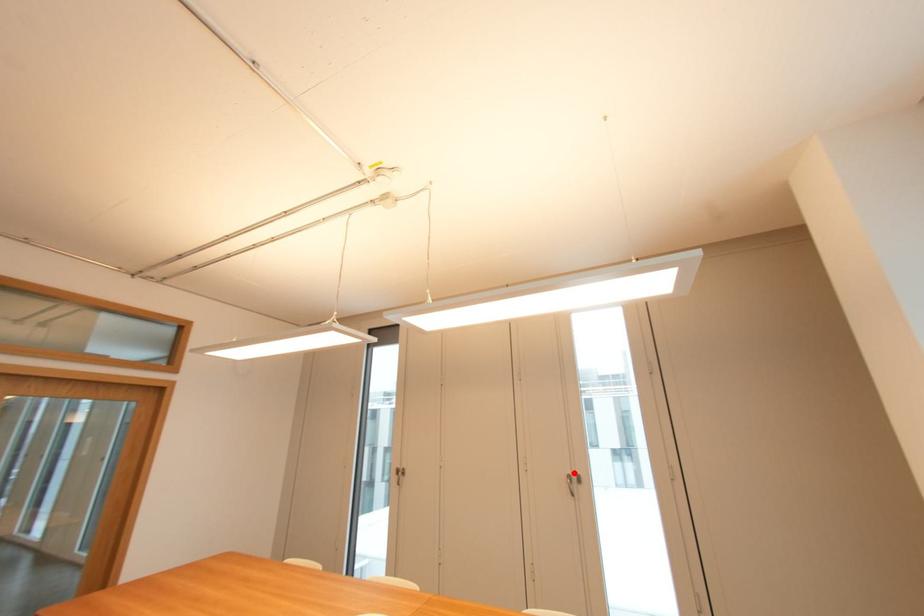
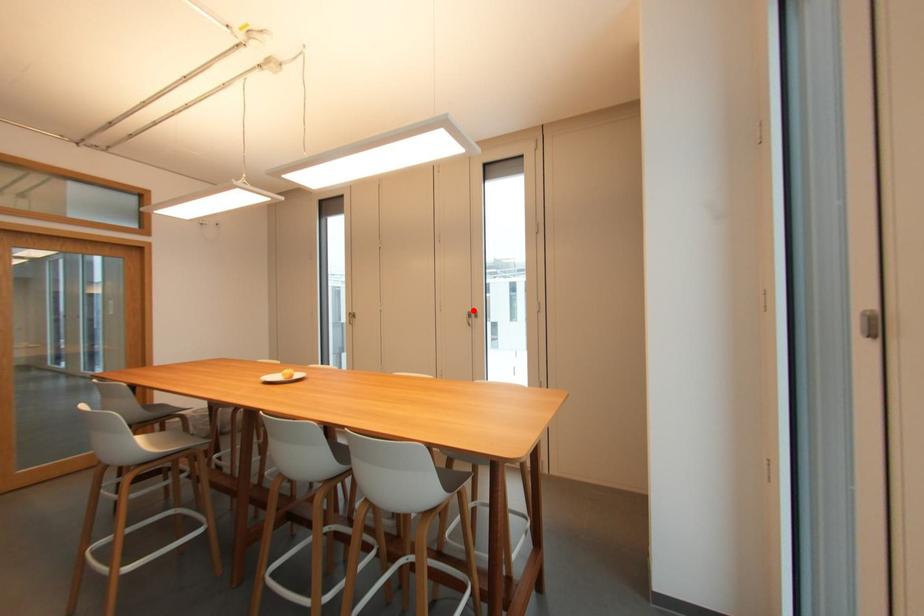
I am providing you with two images of the same scene from different viewpoints. A red point is marked on the first image and another point is marked on the second image. Do the highlighted points in image1 and image2 indicate the same real-world spot?

Yes